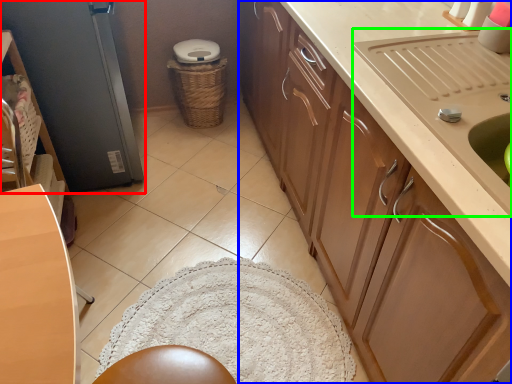
Question: Which object is the farthest from screen door (highlighted by a red box)? Choose among these: cabinetry (highlighted by a blue box) or sink (highlighted by a green box).

Choices:
 (A) cabinetry
 (B) sink

Answer: (B)